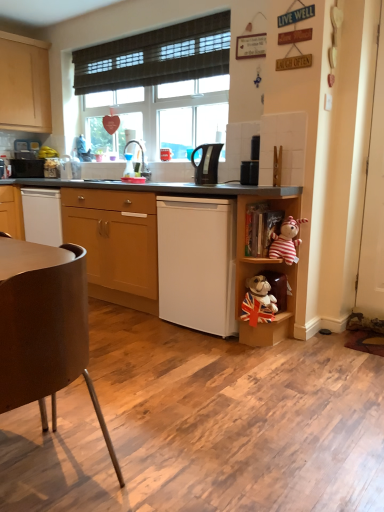
Find the location of `vacant area that is in front of matte wood cabinet at center`. vacant area that is in front of matte wood cabinet at center is located at coordinates (137, 329).